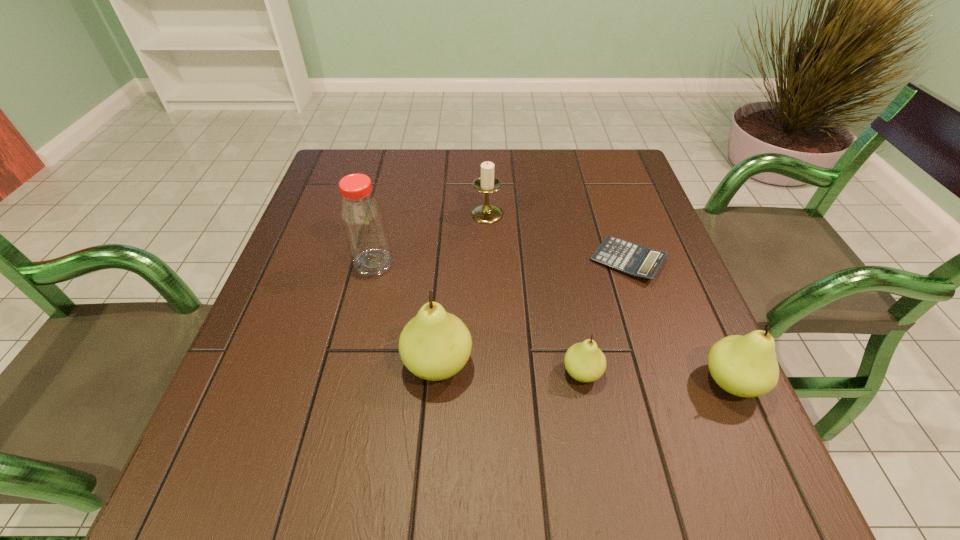
The height and width of the screenshot is (540, 960). Find the location of `vacant space at the right edge`. vacant space at the right edge is located at coordinates (682, 279).

Locate an element on the screen. free space at the far left corner of the desktop is located at coordinates (364, 165).

What are the coordinates of `blank space at the far right corner of the desktop` in the screenshot? It's located at (588, 148).

The image size is (960, 540). Identify the location of blank region between the farthest object and the second pear from left to right. (535, 293).

Find the location of a particular element. Image resolution: width=960 pixels, height=540 pixels. vacant area that lies between the second tallest pear and the leftmost object is located at coordinates (552, 322).

You are a GUI agent. You are given a task and a screenshot of the screen. Output one action in this format:
    pyautogui.click(x=<x>, y=<y>)
    Task: Click on the unoccupied position between the leftmost pear and the shortest pear
    
    Given the screenshot: What is the action you would take?
    pyautogui.click(x=510, y=368)

Identify the location of free space between the farthest object and the second tallest pear. (609, 298).

The height and width of the screenshot is (540, 960). I want to click on vacant space that is in between the leftmost pear and the leftmost object, so click(x=406, y=314).

In order to click on vacant space that is in between the second shortest object and the rightmost pear in this screenshot , I will do `click(657, 377)`.

You are a GUI agent. You are given a task and a screenshot of the screen. Output one action in this format:
    pyautogui.click(x=<x>, y=<y>)
    Task: Click on the vacant area between the candle holder and the second tallest pear
    
    Given the screenshot: What is the action you would take?
    pyautogui.click(x=609, y=298)